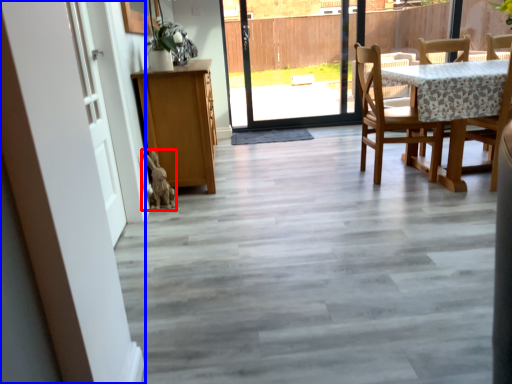
Question: Which point is closer to the camera, animal (highlighted by a red box) or barn door (highlighted by a blue box)?

Choices:
 (A) animal
 (B) barn door

Answer: (B)